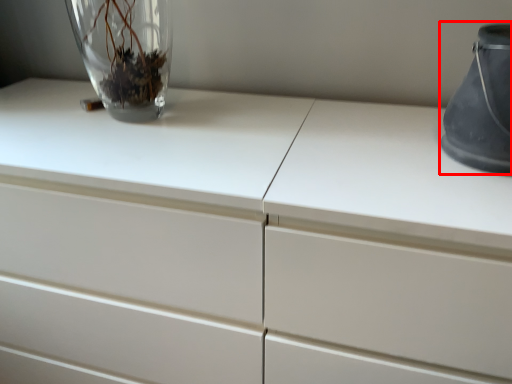
Question: From the image's perspective, what is the correct spatial positioning of vase (annotated by the red box) in reference to vase?

Choices:
 (A) below
 (B) above

Answer: (A)